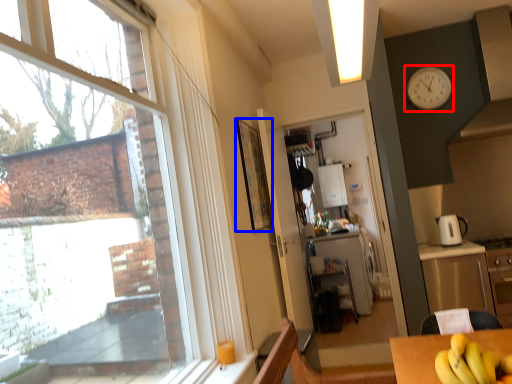
Question: Among these objects, which one is farthest to the camera, clock (highlighted by a red box) or picture frame (highlighted by a blue box)?

Choices:
 (A) clock
 (B) picture frame

Answer: (A)